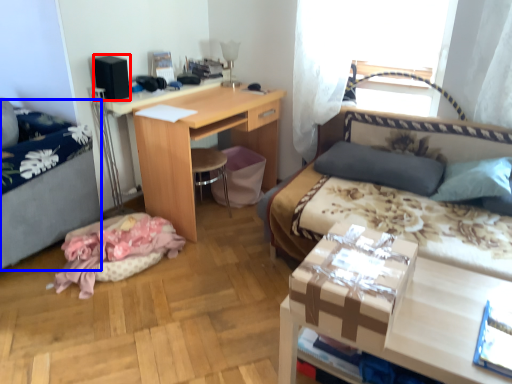
Question: Which object appears closest to the camera in this image, box (highlighted by a red box) or hospital bed (highlighted by a blue box)?

Choices:
 (A) box
 (B) hospital bed

Answer: (B)